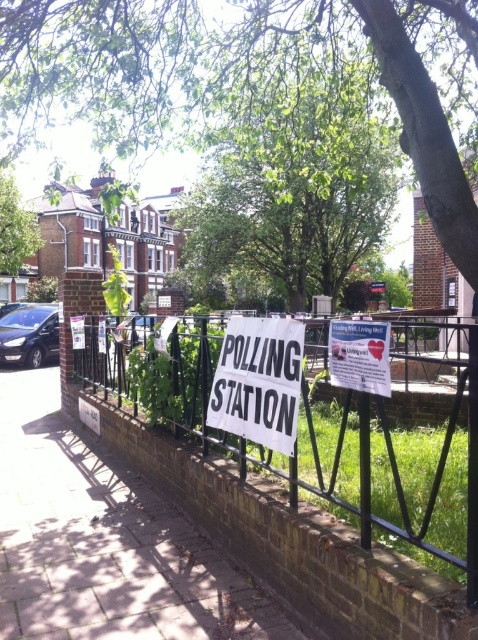
You are standing at the polling station and looking at the scene. There is a point marked at coordinates [96,65]. What object in the scene is located at that point?

The point at coordinates [96,65] is located on the green leafy tree at upper center.

Based on the provided image, what are the coordinates of the green leafy tree at upper center in the scene?

The green leafy tree at upper center is located at coordinates 0.103 in the x axis and 0.201 in the y axis.